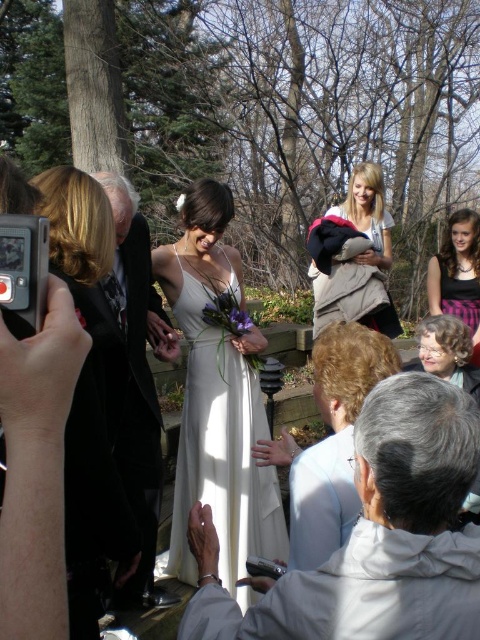
You are a photographer at the wedding and need to decide which garment to focus on for a closeup. The white satin jacket at lower right and the white satin dress at left are both in view. Which one has a wider silhouette?

The white satin jacket at lower right has a wider silhouette than the white satin dress at left.

You are a photographer at the wedding. You need to capture a group photo that includes both the white satin dress at left and the white cotton shirt at upper center. The camera you are using has a maximum focus range of 10 feet. Will you be able to fit both subjects into the frame without moving the camera?

The distance between the white satin dress at left and the white cotton shirt at upper center is 11.03 feet, which exceeds the camera maximum focus range of 10 feet. Therefore, you will not be able to fit both subjects into the frame without moving the camera.